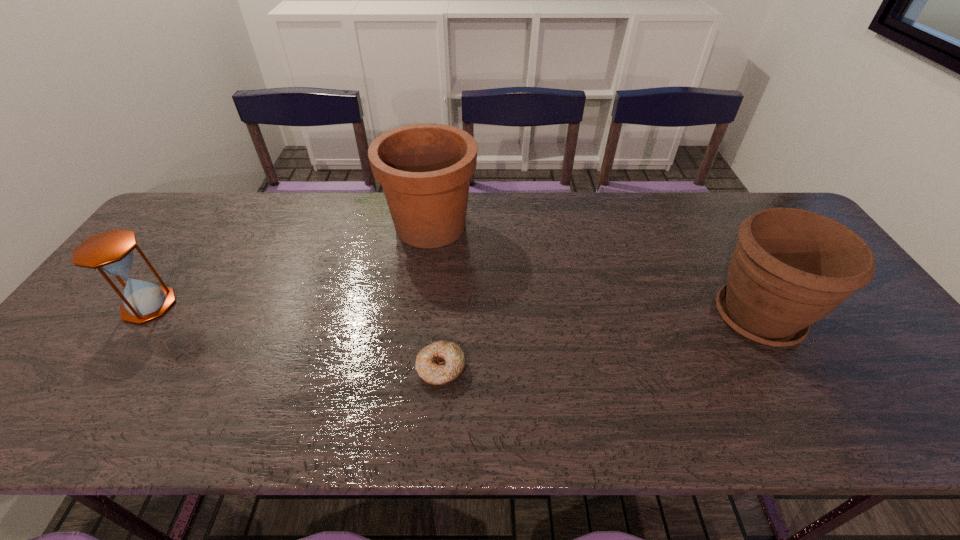
At what (x,y) coordinates should I click in order to perform the action: click on vacant region located on the back of the shortest object. Please return your answer as a coordinate pair (x, y). This screenshot has width=960, height=540. Looking at the image, I should click on (450, 240).

This screenshot has height=540, width=960. In order to click on object situated at the far edge in this screenshot , I will do `click(424, 169)`.

This screenshot has width=960, height=540. Find the location of `object that is at the left edge`. object that is at the left edge is located at coordinates (111, 252).

In order to click on object located in the right edge section of the desktop in this screenshot , I will do `click(790, 268)`.

Find the location of a particular element. vacant space at the far edge is located at coordinates (231, 207).

Identify the location of free region at the near edge. (754, 417).

At what (x,y) coordinates should I click in order to perform the action: click on free spot at the left edge of the desktop. Please return your answer as a coordinate pair (x, y). Looking at the image, I should click on (181, 240).

This screenshot has height=540, width=960. Identify the location of free space at the far left corner of the desktop. (211, 226).

Locate an element on the screen. The image size is (960, 540). unoccupied area between the leftmost object and the right flowerpot is located at coordinates (453, 311).

The image size is (960, 540). Find the location of `free spot between the doughnut and the rightmost object`. free spot between the doughnut and the rightmost object is located at coordinates (600, 343).